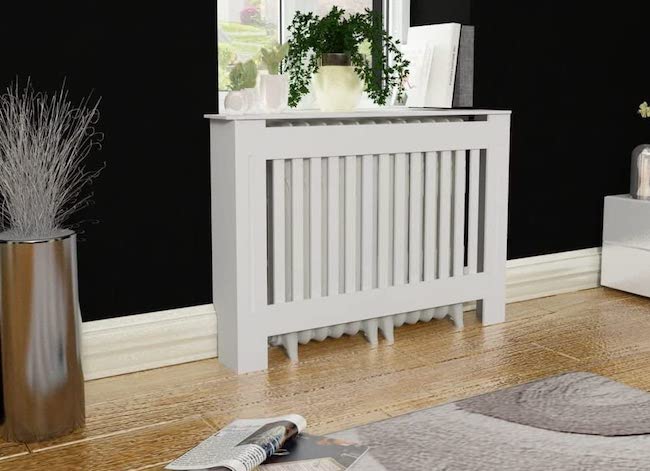
This screenshot has width=650, height=471. I want to click on floor, so click(396, 379).